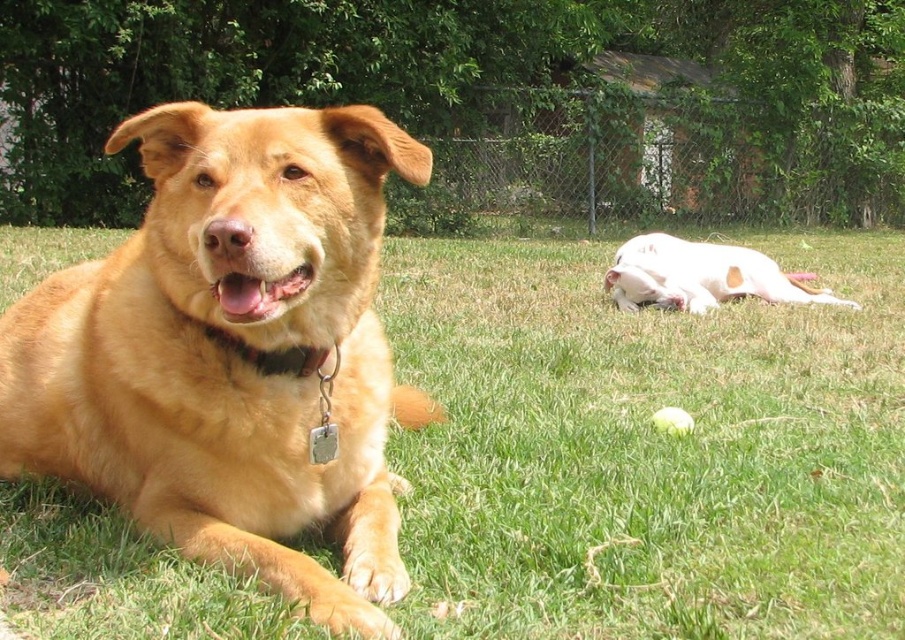
You are a dog owner who wants to place a new toy between the white smooth dog at right and the brown leather collar at center. Based on their heights, which object should be placed higher to ensure the toy is visible to both?

The white smooth dog at right is much taller than the brown leather collar at center. To ensure visibility for both, the toy should be placed at a height that accommodates the taller white smooth dog at right, so it can see over the collar.

You are a dog owner who wants to ensure your dog can rest comfortably on the green grass at center. However, you notice the brown leather collar at center might be in the way. Is the collar blocking the grass area where the dog is lying?

The green grass at center is in front of the brown leather collar at center, meaning the collar is not blocking the grass area. The grass is positioned in front of the collar, so the dog can rest comfortably without obstruction.